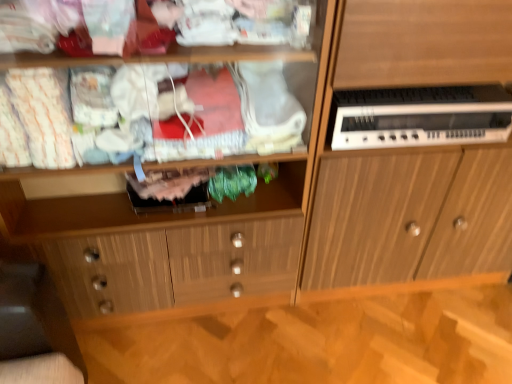
Question: Is point (344, 283) closer or farther from the camera than point (333, 134)?

Choices:
 (A) farther
 (B) closer

Answer: (A)

Question: Is wooden cabinet at right to the left or to the right of white plastic electronic device at right in the image?

Choices:
 (A) right
 (B) left

Answer: (A)

Question: Which object is positioned closest to the wooden cabinet at right?

Choices:
 (A) white plastic electronic device at right
 (B) wooden cabinet at center

Answer: (A)

Question: Which is nearer to the white plastic electronic device at right?

Choices:
 (A) wooden cabinet at right
 (B) wooden cabinet at center

Answer: (A)